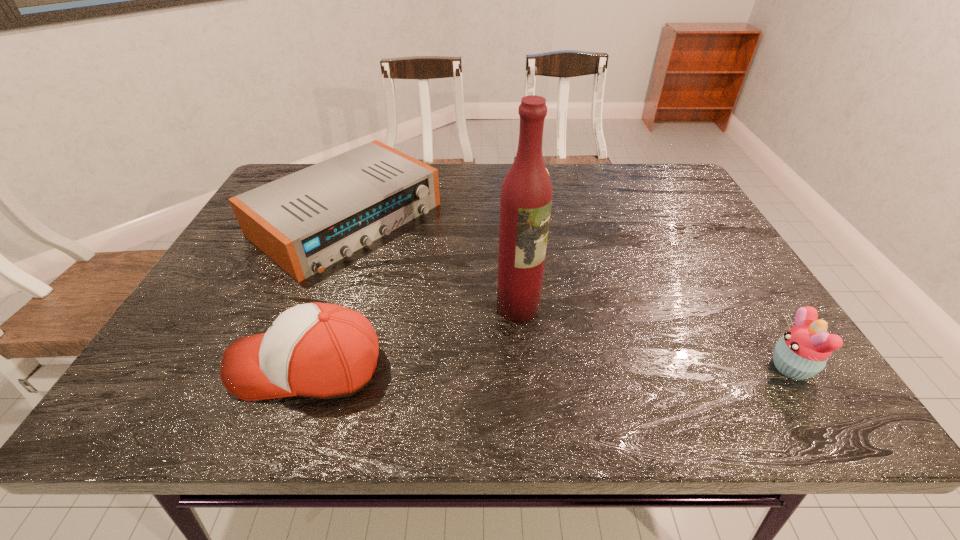
Find the location of `free space on the desktop that is between the baseball cap and the rightmost object and is positioned on the front panel of the radio receiver`. free space on the desktop that is between the baseball cap and the rightmost object and is positioned on the front panel of the radio receiver is located at coordinates (570, 367).

Where is `free space on the desktop that is between the baseball cap and the cupcake and is positioned at the beak of the duck`? This screenshot has width=960, height=540. free space on the desktop that is between the baseball cap and the cupcake and is positioned at the beak of the duck is located at coordinates (551, 367).

Image resolution: width=960 pixels, height=540 pixels. In order to click on vacant spot on the desktop that is between the baseball cap and the cupcake and is positioned on the label of the third nearest object in this screenshot , I will do `click(607, 367)`.